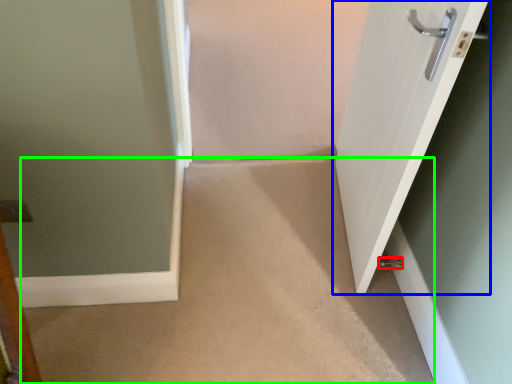
Question: Which object is positioned closest to door handle (highlighted by a red box)? Select from door (highlighted by a blue box) and corridor (highlighted by a green box).

Choices:
 (A) door
 (B) corridor

Answer: (B)